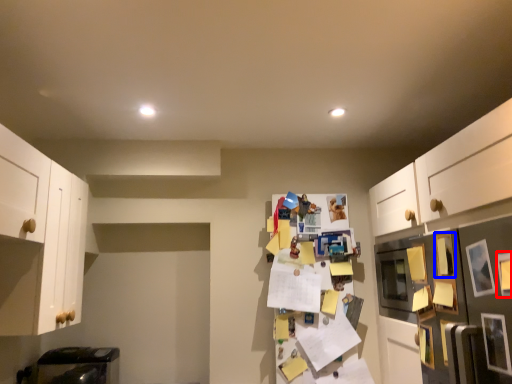
Question: Which object is closer to the camera taking this photo, picture frame (highlighted by a red box) or picture frame (highlighted by a blue box)?

Choices:
 (A) picture frame
 (B) picture frame

Answer: (A)